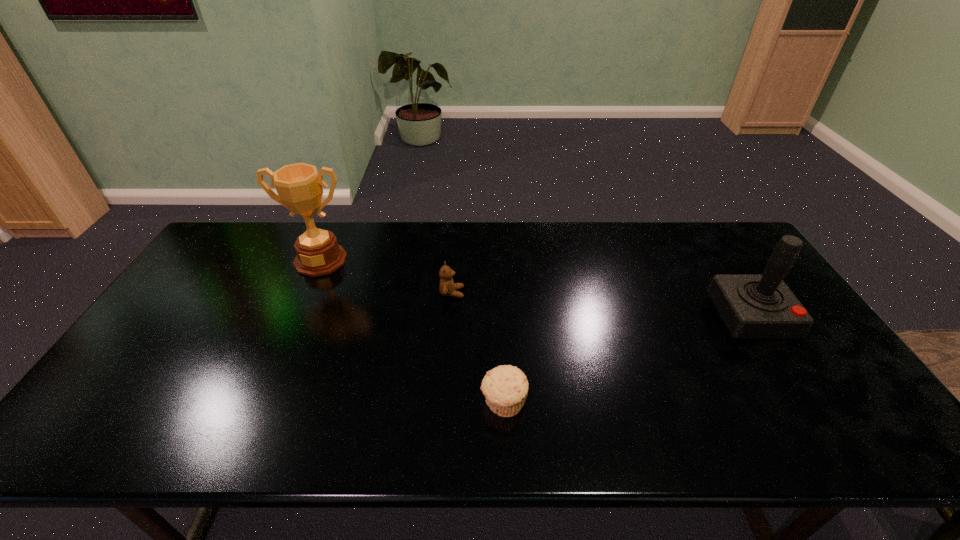
Where is `free spot between the teddy bear and the nearest object`? The image size is (960, 540). free spot between the teddy bear and the nearest object is located at coordinates (478, 348).

Identify which object is the second closest to the farthest object. Please provide its 2D coordinates. Your answer should be formatted as a tuple, i.e. [(x, y)], where the tuple contains the x and y coordinates of a point satisfying the conditions above.

[(505, 387)]

Image resolution: width=960 pixels, height=540 pixels. What are the coordinates of `object that stands as the third closest to the second object from left to right` in the screenshot? It's located at (752, 306).

Find the location of a particular element. The width and height of the screenshot is (960, 540). vacant space that satisfies the following two spatial constraints: 1. on the front-facing side of the nearest object; 2. on the left side of the second object from left to right is located at coordinates (444, 403).

Where is `vacant space that satisfies the following two spatial constraints: 1. on the front-facing side of the teddy bear; 2. on the back side of the nearest object`? vacant space that satisfies the following two spatial constraints: 1. on the front-facing side of the teddy bear; 2. on the back side of the nearest object is located at coordinates (444, 403).

Where is `free space that satisfies the following two spatial constraints: 1. on the front-facing side of the award; 2. on the left side of the muffin`? Image resolution: width=960 pixels, height=540 pixels. free space that satisfies the following two spatial constraints: 1. on the front-facing side of the award; 2. on the left side of the muffin is located at coordinates pyautogui.click(x=258, y=403).

Identify the location of vacant point that satisfies the following two spatial constraints: 1. on the front-facing side of the second object from right to left; 2. on the left side of the third object from right to left. This screenshot has width=960, height=540. (444, 403).

The height and width of the screenshot is (540, 960). I want to click on free space in the image that satisfies the following two spatial constraints: 1. on the front-facing side of the third object from right to left; 2. on the left side of the nearest object, so click(x=444, y=403).

Identify the location of free space that satisfies the following two spatial constraints: 1. on the front-facing side of the third object from left to right; 2. on the right side of the second object from left to right. The width and height of the screenshot is (960, 540). (444, 403).

In order to click on vacant space that satisfies the following two spatial constraints: 1. on the front-facing side of the third object from right to left; 2. on the left side of the second object from right to left in this screenshot , I will do `click(444, 403)`.